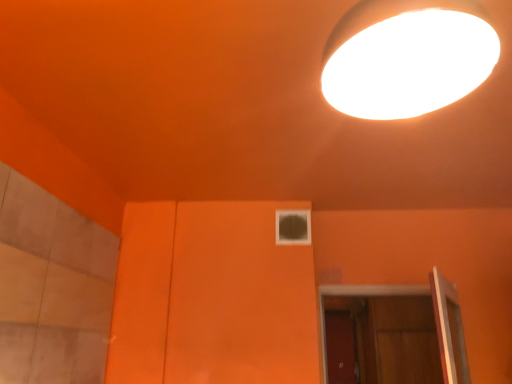
The width and height of the screenshot is (512, 384). Describe the element at coordinates (395, 294) in the screenshot. I see `wooden at lower right` at that location.

Where is `wooden at lower right`? This screenshot has width=512, height=384. wooden at lower right is located at coordinates (395, 294).

Considering the positions of objects transparent glass window at center and wooden at lower right in the image provided, who is more to the left, transparent glass window at center or wooden at lower right?

Positioned to the left is transparent glass window at center.

Is transparent glass window at center positioned before wooden at lower right?

Yes, the depth of transparent glass window at center is less than that of wooden at lower right.

Do you think transparent glass window at center is within wooden at lower right, or outside of it?

transparent glass window at center is not enclosed by wooden at lower right.

Is transparent glass window at center positioned with its back to wooden at lower right?

That's not correct — transparent glass window at center is not looking away from wooden at lower right.

Is white glossy lamp at upper right aimed at wooden at lower right?

Yes, white glossy lamp at upper right is facing wooden at lower right.

Would you say wooden at lower right is part of white glossy lamp at upper right's contents?

No, wooden at lower right is not surrounded by white glossy lamp at upper right.

Is white glossy lamp at upper right wider than wooden at lower right?

Incorrect, the width of white glossy lamp at upper right does not surpass that of wooden at lower right.

Can you confirm if white glossy lamp at upper right is positioned to the right of wooden at lower right?

No, white glossy lamp at upper right is not to the right of wooden at lower right.

Considering the relative sizes of transparent glass window at center and white glossy lamp at upper right in the image provided, is transparent glass window at center shorter than white glossy lamp at upper right?

Yes, transparent glass window at center is shorter than white glossy lamp at upper right.

From the image's perspective, is transparent glass window at center below white glossy lamp at upper right?

Yes, from the image's perspective, transparent glass window at center is beneath white glossy lamp at upper right.

Which object is closer to the camera, transparent glass window at center or white glossy lamp at upper right?

white glossy lamp at upper right is in front.

Can you confirm if transparent glass window at center is bigger than white glossy lamp at upper right?

Actually, transparent glass window at center might be smaller than white glossy lamp at upper right.

From the image's perspective, is wooden at lower right below transparent glass window at center?

Yes.

Where is `window in front of the wooden at lower right`? The image size is (512, 384). window in front of the wooden at lower right is located at coordinates (293, 227).

From their relative heights in the image, would you say wooden at lower right is taller or shorter than transparent glass window at center?

Clearly, wooden at lower right is taller compared to transparent glass window at center.

Can you confirm if wooden at lower right is thinner than transparent glass window at center?

No.

Does white glossy lamp at upper right turn towards transparent glass window at center?

Yes, white glossy lamp at upper right is facing transparent glass window at center.

Can you confirm if white glossy lamp at upper right is positioned to the right of transparent glass window at center?

Yes, white glossy lamp at upper right is to the right of transparent glass window at center.

Does point (474, 24) lie in front of point (302, 232)?

Yes, it is.

Considering the sizes of objects wooden at lower right and white glossy lamp at upper right in the image provided, who is bigger, wooden at lower right or white glossy lamp at upper right?

Bigger between the two is wooden at lower right.

What's the angular difference between wooden at lower right and white glossy lamp at upper right's facing directions?

178 degrees.

How distant is wooden at lower right from white glossy lamp at upper right?

wooden at lower right is 4.37 feet from white glossy lamp at upper right.

Would you say white glossy lamp at upper right is part of wooden at lower right's contents?

No, wooden at lower right does not contain white glossy lamp at upper right.

Locate an element on the screen. Image resolution: width=512 pixels, height=384 pixels. window positioned vertically above the wooden at lower right (from a real-world perspective) is located at coordinates (293, 227).

Find the location of a particular element. lamp above the wooden at lower right (from the image's perspective) is located at coordinates point(407,57).

Looking at the image, which one is located further to transparent glass window at center, wooden at lower right or white glossy lamp at upper right?

white glossy lamp at upper right is positioned further to the anchor transparent glass window at center.

Considering their positions, is transparent glass window at center positioned further to white glossy lamp at upper right than wooden at lower right?

The object further to white glossy lamp at upper right is transparent glass window at center.

Looking at the image, which one is located further to wooden at lower right, white glossy lamp at upper right or transparent glass window at center?

Among the two, white glossy lamp at upper right is located further to wooden at lower right.

Which object lies further to the anchor point transparent glass window at center, white glossy lamp at upper right or wooden at lower right?

white glossy lamp at upper right is positioned further to the anchor transparent glass window at center.

From the picture: When comparing their distances from white glossy lamp at upper right, does wooden at lower right or transparent glass window at center seem further?

Based on the image, transparent glass window at center appears to be further to white glossy lamp at upper right.

From the image, which object appears to be farther from wooden at lower right, transparent glass window at center or white glossy lamp at upper right?

white glossy lamp at upper right.

Where is `window between white glossy lamp at upper right and wooden at lower right from front to back`? The width and height of the screenshot is (512, 384). window between white glossy lamp at upper right and wooden at lower right from front to back is located at coordinates (293, 227).